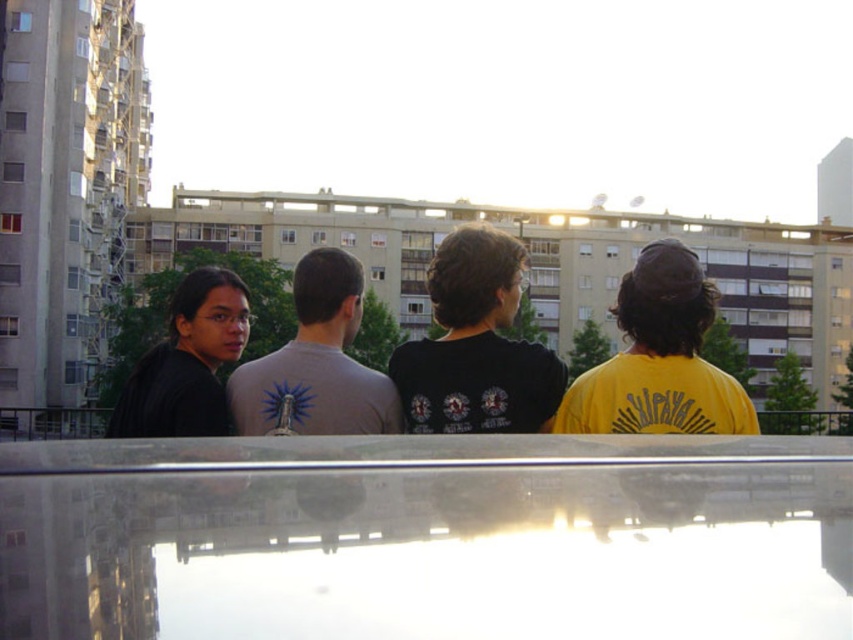
Is black matte t-shirt at center further to the viewer compared to black matte shirt at left?

No, it is not.

Who is taller, black matte t-shirt at center or black matte shirt at left?

Standing taller between the two is black matte shirt at left.

Is point (496, 387) in front of point (140, 404)?

Yes, point (496, 387) is in front of point (140, 404).

In order to click on black matte t-shirt at center in this screenshot , I will do `click(476, 346)`.

Which is more to the right, gray matte t-shirt at center or black matte shirt at left?

gray matte t-shirt at center is more to the right.

Can you confirm if gray matte t-shirt at center is wider than black matte shirt at left?

No.

Which is in front, point (328, 429) or point (219, 403)?

Point (328, 429) is more forward.

Where is `gray matte t-shirt at center`? The height and width of the screenshot is (640, 853). gray matte t-shirt at center is located at coordinates (317, 362).

Can you confirm if yellow matte shirt at upper right is thinner than black matte shirt at left?

Indeed, yellow matte shirt at upper right has a lesser width compared to black matte shirt at left.

Does point (700, 369) come closer to viewer compared to point (242, 284)?

Yes.

Who is more forward, (x=718, y=401) or (x=219, y=301)?

Positioned in front is point (x=718, y=401).

In order to click on yellow matte shirt at upper right in this screenshot , I will do `click(659, 358)`.